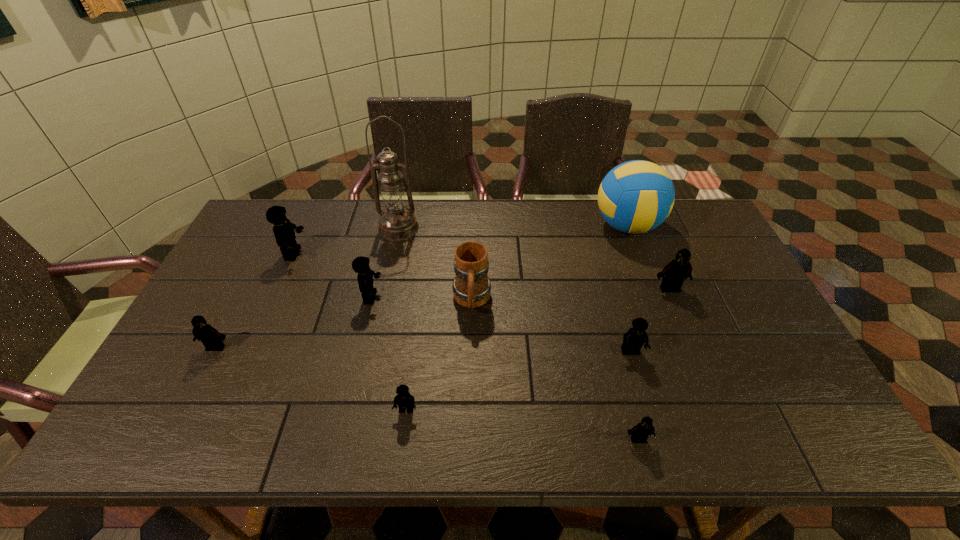
Locate an element on the screen. free space at the left edge of the desktop is located at coordinates (214, 350).

In the image, there is a desktop. Where is `vacant area at the right edge`? The image size is (960, 540). vacant area at the right edge is located at coordinates (714, 255).

You are a GUI agent. You are given a task and a screenshot of the screen. Output one action in this format:
    pyautogui.click(x=<x>, y=<y>)
    Task: Click on the vacant region at the near left corner
    This screenshot has height=540, width=960.
    Given the screenshot: What is the action you would take?
    pyautogui.click(x=173, y=442)

In the image, there is a desktop. Where is `free space at the far right corner`? This screenshot has height=540, width=960. free space at the far right corner is located at coordinates (709, 243).

Identify the location of vacant area that lies between the mug and the second biggest yellow Lego. This screenshot has width=960, height=540. click(421, 299).

Locate an element on the screen. This screenshot has height=540, width=960. vacant space that's between the smallest yellow Lego and the nearest object is located at coordinates (522, 424).

Find the location of `vacant area that lies between the fifth object from right to left and the leftmost object`. vacant area that lies between the fifth object from right to left and the leftmost object is located at coordinates (344, 324).

Where is `free space between the fifth object from right to left and the farthest Lego`? The width and height of the screenshot is (960, 540). free space between the fifth object from right to left and the farthest Lego is located at coordinates (383, 277).

This screenshot has width=960, height=540. Identify the location of free space between the leftmost object and the rightmost Lego. (443, 318).

Where is `free space between the second biggest black Lego and the second tallest object`? The height and width of the screenshot is (540, 960). free space between the second biggest black Lego and the second tallest object is located at coordinates (x=421, y=287).